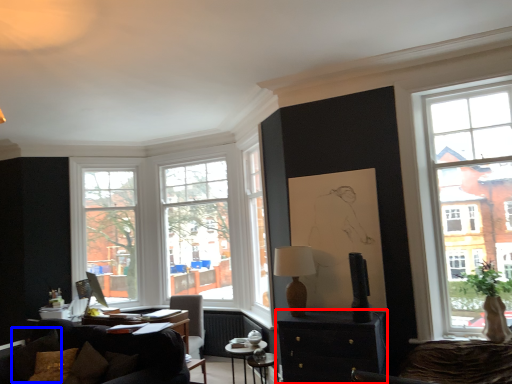
Question: Which point is closer to the camera, cabinetry (highlighted by a red box) or pillow (highlighted by a blue box)?

Choices:
 (A) cabinetry
 (B) pillow

Answer: (A)